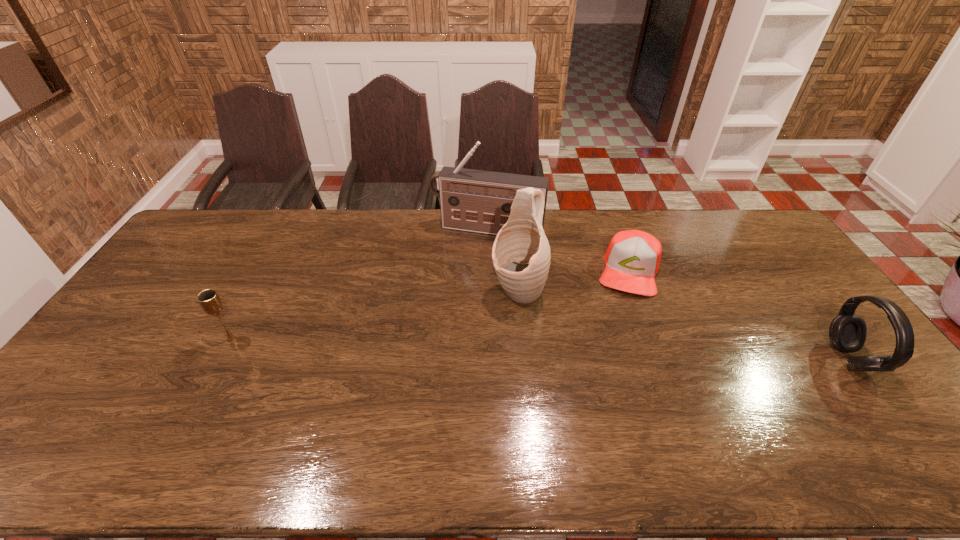
This screenshot has height=540, width=960. Find the location of `vacant area that lies between the pitcher and the leftmost object`. vacant area that lies between the pitcher and the leftmost object is located at coordinates (374, 315).

The image size is (960, 540). Find the location of `empty location between the farthest object and the chalice`. empty location between the farthest object and the chalice is located at coordinates (360, 284).

Locate which object ranks in proximity to the rightmost object. Please provide its 2D coordinates. Your answer should be formatted as a tuple, i.e. [(x, y)], where the tuple contains the x and y coordinates of a point satisfying the conditions above.

[(632, 260)]

Find the location of a particular element. The height and width of the screenshot is (540, 960). object that is the fourth closest to the rightmost object is located at coordinates (209, 300).

Locate an element on the screen. free spot that satisfies the following two spatial constraints: 1. on the front side of the farthest object; 2. on the left side of the second object from right to left is located at coordinates click(x=489, y=271).

Where is `free space that satisfies the following two spatial constraints: 1. on the back side of the shortest object; 2. on the right side of the chalice`? free space that satisfies the following two spatial constraints: 1. on the back side of the shortest object; 2. on the right side of the chalice is located at coordinates (267, 271).

Find the location of a particular element. This screenshot has height=540, width=960. blank area in the image that satisfies the following two spatial constraints: 1. on the back side of the leftmost object; 2. on the right side of the radio receiver is located at coordinates (289, 230).